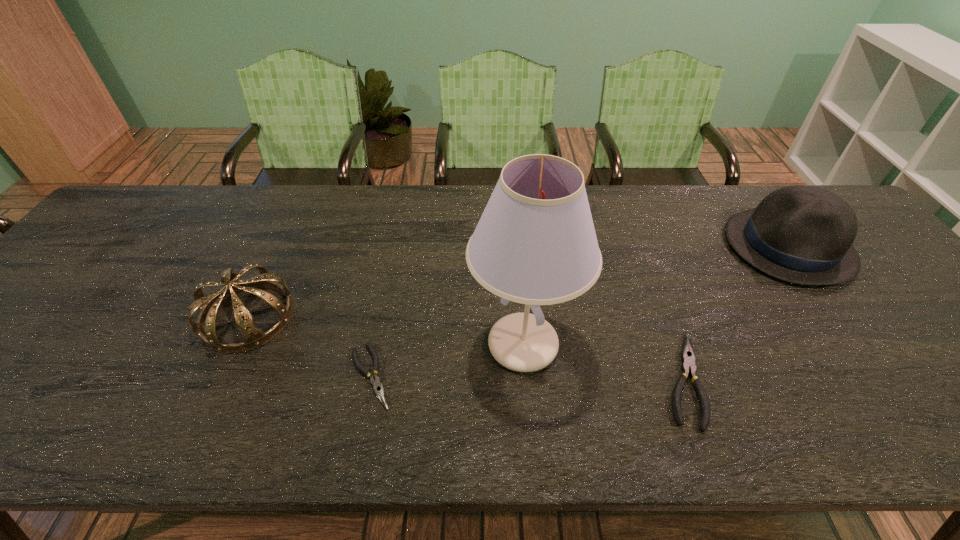
Considering the uniform spacing of plierss, where should an additional pliers be positioned on the left? Please locate a free spot. Please provide its 2D coordinates. Your answer should be formatted as a tuple, i.e. [(x, y)], where the tuple contains the x and y coordinates of a point satisfying the conditions above.

[(62, 373)]